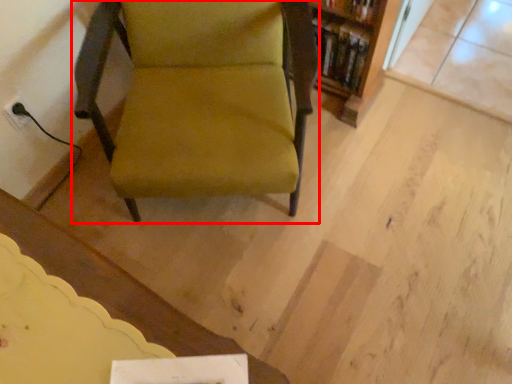
Question: From the image's perspective, considering the relative positions of chair (annotated by the red box) and shelf in the image provided, where is chair (annotated by the red box) located with respect to the staircase?

Choices:
 (A) below
 (B) above

Answer: (A)